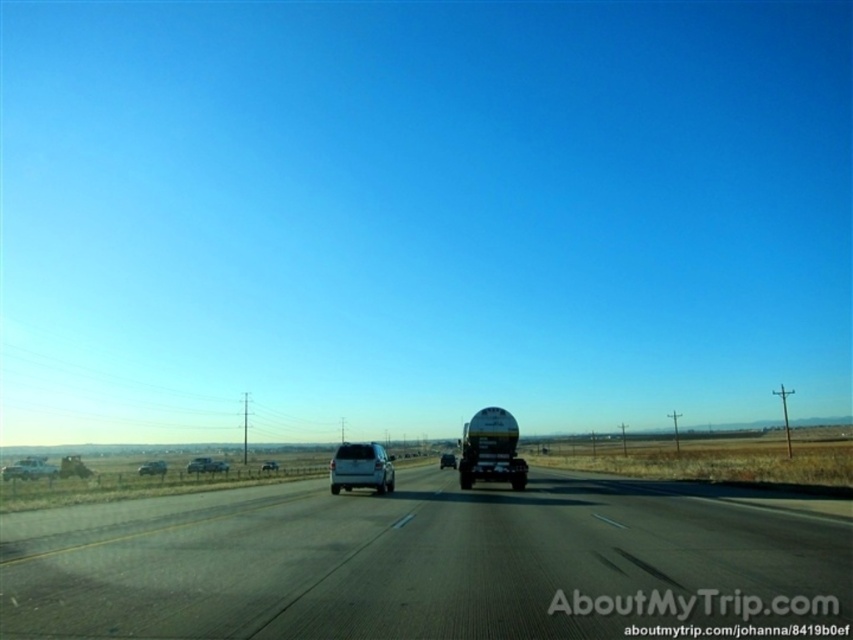
Is satin silver suv at center taller than silver metallic sedan at lower left?

Yes, satin silver suv at center is taller than silver metallic sedan at lower left.

Does satin silver suv at center have a smaller size compared to silver metallic sedan at lower left?

Incorrect, satin silver suv at center is not smaller in size than silver metallic sedan at lower left.

This screenshot has width=853, height=640. What are the coordinates of `satin silver suv at center` in the screenshot? It's located at (360, 467).

Which is in front, point (373, 456) or point (260, 467)?

Point (373, 456)

Measure the distance between point [339,445] and camera.

They are 719.78 feet apart.

Is point (334, 481) positioned before point (271, 460)?

Yes, it is in front of point (271, 460).

The image size is (853, 640). I want to click on satin silver suv at center, so click(360, 467).

Who is positioned more to the left, black asphalt highway at center or glossy white suv at center?

From the viewer's perspective, black asphalt highway at center appears more on the left side.

Based on the photo, is black asphalt highway at center taller than glossy white suv at center?

No.

Where is `black asphalt highway at center`? The image size is (853, 640). black asphalt highway at center is located at coordinates (422, 561).